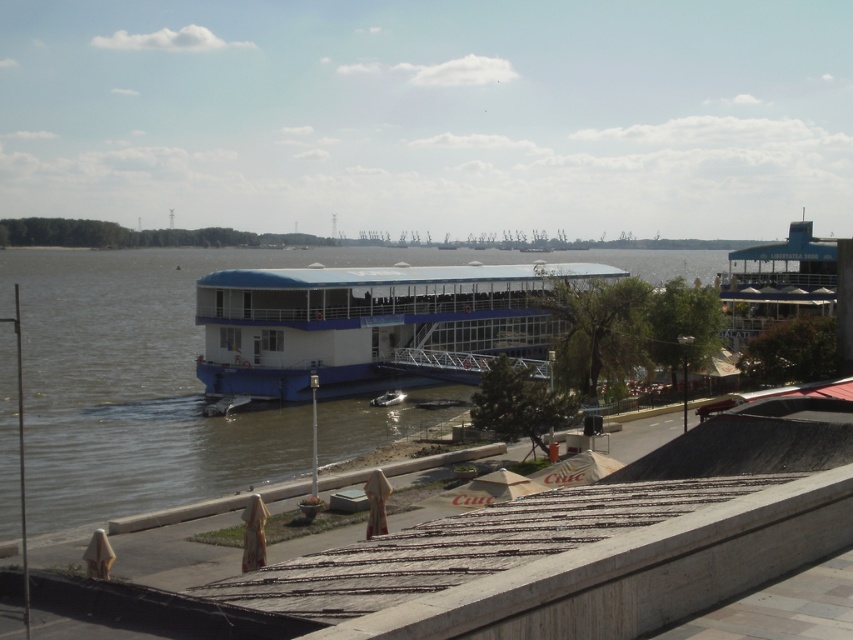
Can you confirm if white glossy boat at center is positioned above metallic silver boat at center?

Correct, white glossy boat at center is located above metallic silver boat at center.

Is white glossy boat at center positioned in front of metallic silver boat at center?

Yes, it is in front of metallic silver boat at center.

Where is `white glossy boat at center`? The width and height of the screenshot is (853, 640). white glossy boat at center is located at coordinates (374, 324).